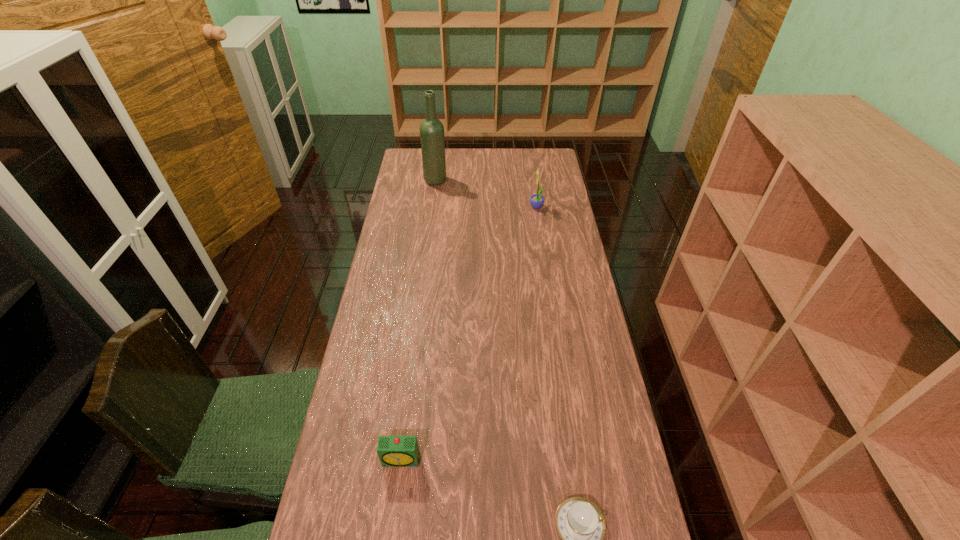
The height and width of the screenshot is (540, 960). What are the coordinates of `free space that satisfies the following two spatial constraints: 1. on the front-facing side of the sunflower; 2. on the front-facing side of the alarm clock` in the screenshot? It's located at (575, 460).

The width and height of the screenshot is (960, 540). I want to click on vacant point that satisfies the following two spatial constraints: 1. on the front-facing side of the sunflower; 2. on the front-facing side of the third farthest object, so click(575, 460).